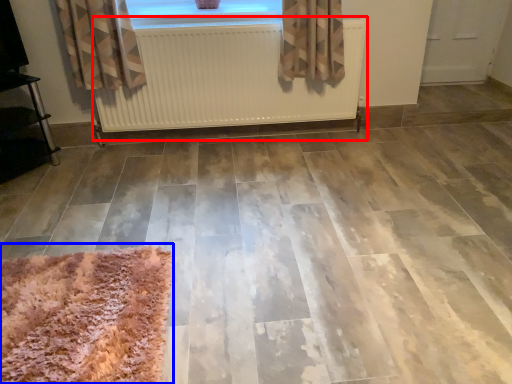
Question: Which point is further to the camera, radiator (highlighted by a red box) or mat (highlighted by a blue box)?

Choices:
 (A) radiator
 (B) mat

Answer: (A)